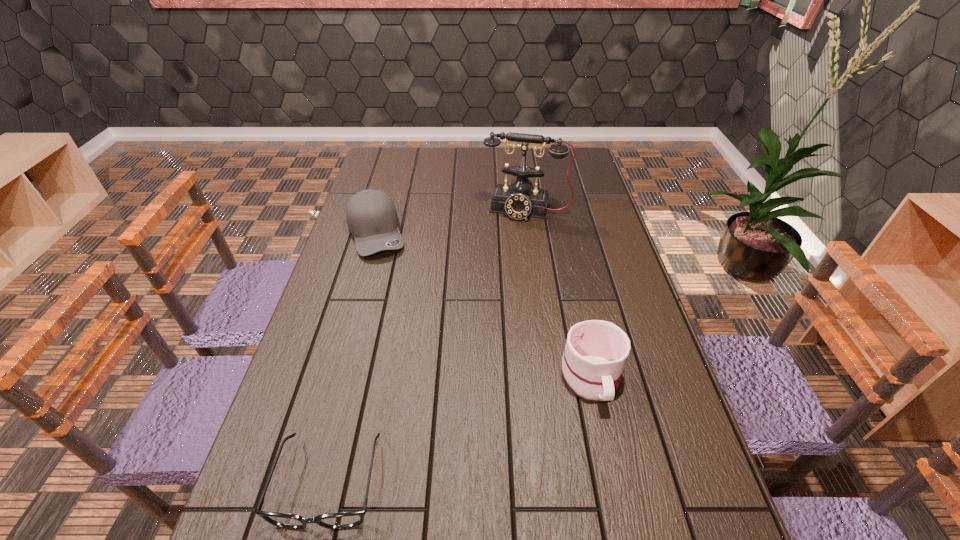
This screenshot has width=960, height=540. In order to click on vacant space at the right edge of the desktop in this screenshot , I will do 579,200.

This screenshot has width=960, height=540. In the image, there is a desktop. Find the location of `vacant space at the far left corner`. vacant space at the far left corner is located at coordinates (384, 162).

In the image, there is a desktop. Identify the location of vacant space at the far right corner. (584, 159).

Identify the location of free spot between the baseball cap and the telephone. (451, 221).

At what (x,y) coordinates should I click in order to perform the action: click on empty location between the nearest object and the mug. Please return your answer as a coordinate pair (x, y). The width and height of the screenshot is (960, 540). Looking at the image, I should click on (460, 429).

Where is `free space between the shortest object and the baseball cap`? This screenshot has width=960, height=540. free space between the shortest object and the baseball cap is located at coordinates point(352,357).

In order to click on free space between the tallest object and the mug in this screenshot , I will do `click(559, 293)`.

Identify the location of vacant region between the mug and the spectacles. The width and height of the screenshot is (960, 540). (460, 429).

This screenshot has width=960, height=540. I want to click on empty location between the nearest object and the baseball cap, so click(x=352, y=357).

What are the coordinates of `free spot between the baseball cap and the spectacles` in the screenshot? It's located at (352, 357).